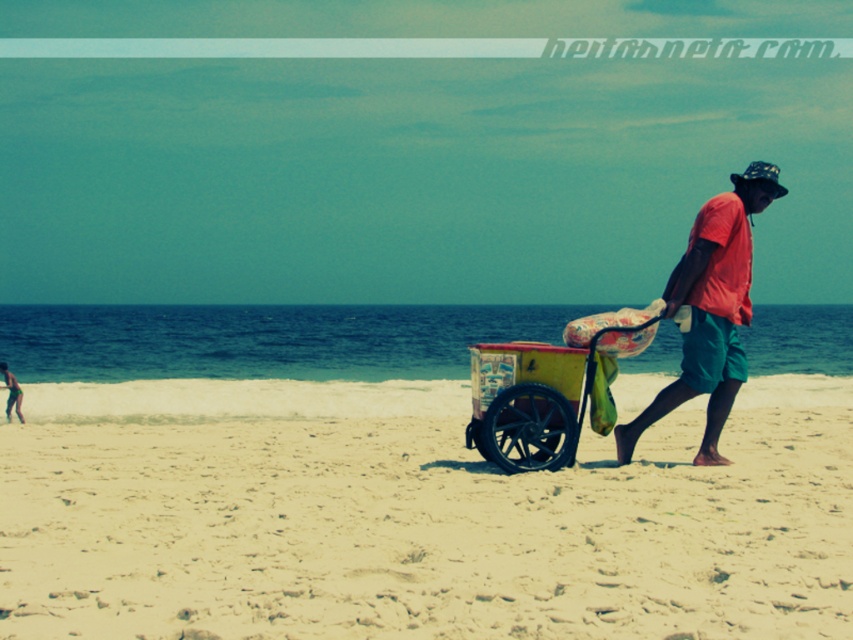
You are standing on the beach and see a man walking with a red cotton shirt at center and a yellow painted wood cart at center. Which object is closer to you?

The red cotton shirt at center is closer to you because it is further to the viewer than the yellow painted wood cart at center.

You are standing on the beige sandy beach at center and want to reach the yellow painted wood cart at center. Which direction should you move to get closer to the cart?

Since the beige sandy beach at center is closer to you than the yellow painted wood cart at center, you should move away from the current position towards the direction of the cart to reach it.